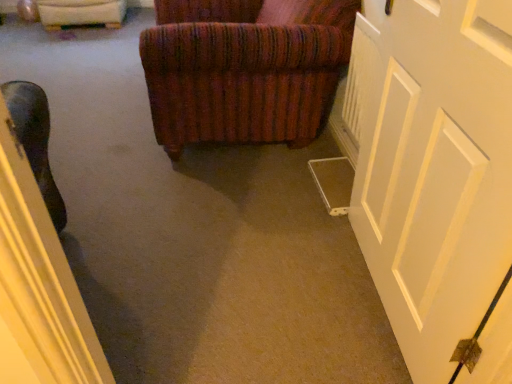
The height and width of the screenshot is (384, 512). Describe the element at coordinates (438, 179) in the screenshot. I see `white painted wood door at right` at that location.

Where is `white painted wood door at right`? This screenshot has height=384, width=512. white painted wood door at right is located at coordinates (438, 179).

Measure the distance between point (398, 249) and camera.

1.32 meters.

This screenshot has height=384, width=512. Identify the location of white painted wood door at right. (438, 179).